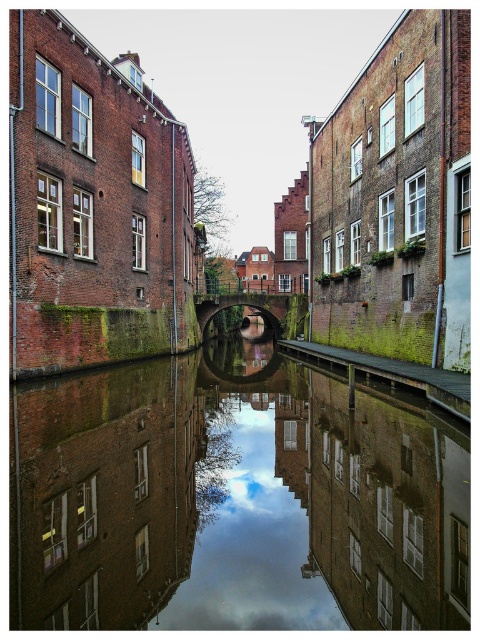
Between smooth reflective water at center and green mossy brick alley at lower right, which one has less height?

green mossy brick alley at lower right is shorter.

Who is positioned more to the right, smooth reflective water at center or green mossy brick alley at lower right?

green mossy brick alley at lower right

Does point (302, 465) come farther from viewer compared to point (372, 364)?

No, it is in front of (372, 364).

Identify the location of smooth reflective water at center. This screenshot has width=480, height=640. (231, 500).